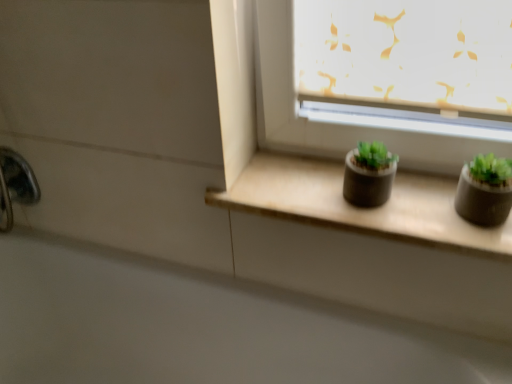
Question: From the image's perspective, is matte concrete window sill at center below white glossy bath at lower left?

Choices:
 (A) yes
 (B) no

Answer: (B)

Question: Can you confirm if matte concrete window sill at center is bigger than white glossy bath at lower left?

Choices:
 (A) no
 (B) yes

Answer: (A)

Question: Does matte concrete window sill at center touch white glossy bath at lower left?

Choices:
 (A) yes
 (B) no

Answer: (B)

Question: Is matte concrete window sill at center positioned far away from white glossy bath at lower left?

Choices:
 (A) yes
 (B) no

Answer: (B)

Question: Considering the relative sizes of matte concrete window sill at center and white glossy bath at lower left in the image provided, is matte concrete window sill at center shorter than white glossy bath at lower left?

Choices:
 (A) no
 (B) yes

Answer: (B)

Question: Does matte concrete window sill at center turn towards white glossy bath at lower left?

Choices:
 (A) no
 (B) yes

Answer: (A)

Question: Is matte gray flowerpot at right, positioned as the second flowerpot in left-to-right order, bigger than polished chrome faucet at lower left?

Choices:
 (A) no
 (B) yes

Answer: (A)

Question: Are matte gray flowerpot at right, positioned as the second flowerpot in left-to-right order, and polished chrome faucet at lower left located far from each other?

Choices:
 (A) yes
 (B) no

Answer: (A)

Question: Is matte gray flowerpot at right, positioned as the second flowerpot in left-to-right order, wider than polished chrome faucet at lower left?

Choices:
 (A) no
 (B) yes

Answer: (B)

Question: From the image's perspective, is matte gray flowerpot at right, positioned as the second flowerpot in left-to-right order, beneath polished chrome faucet at lower left?

Choices:
 (A) yes
 (B) no

Answer: (A)

Question: Is matte gray flowerpot at right, positioned as the second flowerpot in left-to-right order, touching polished chrome faucet at lower left?

Choices:
 (A) no
 (B) yes

Answer: (A)

Question: From a real-world perspective, is matte gray flowerpot at right, which ranks as the 1th flowerpot in right-to-left order, positioned over polished chrome faucet at lower left based on gravity?

Choices:
 (A) yes
 (B) no

Answer: (A)

Question: From a real-world perspective, is matte concrete window sill at center positioned under polished chrome faucet at lower left based on gravity?

Choices:
 (A) yes
 (B) no

Answer: (B)